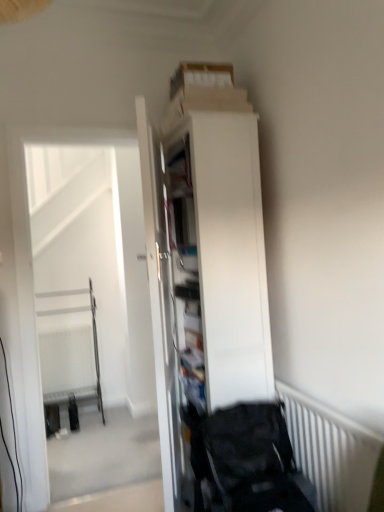
What do you see at coordinates (160, 301) in the screenshot?
I see `white glossy door at center` at bounding box center [160, 301].

Measure the distance between point (289, 449) and camera.

They are 6.43 feet apart.

The height and width of the screenshot is (512, 384). Identify the location of white striped radiator at lower right. click(331, 451).

Which object is thinner, white glossy door at center or black fabric baby carriage at lower right?

white glossy door at center is thinner.

From a real-world perspective, is white glossy door at center positioned over black fabric baby carriage at lower right based on gravity?

Yes.

How different are the orientations of white glossy door at center and black fabric baby carriage at lower right in degrees?

107 degrees separate the facing orientations of white glossy door at center and black fabric baby carriage at lower right.

Is white glossy door at center far away from white matte cabinet at center?

No, there isn't a large distance between white glossy door at center and white matte cabinet at center.

Could white matte cabinet at center be considered to be inside white glossy door at center?

No, white matte cabinet at center is located outside of white glossy door at center.

Is point (170, 390) closer or farther from the camera than point (206, 191)?

Point (170, 390) appears to be closer to the viewer than point (206, 191).

How many degrees apart are the facing directions of white glossy door at center and white matte cabinet at center?

They differ by 17.9 degrees in their facing directions.

Is white striped radiator at lower right far from black fabric baby carriage at lower right?

white striped radiator at lower right is actually quite close to black fabric baby carriage at lower right.

In the scene shown: Is white striped radiator at lower right inside or outside of black fabric baby carriage at lower right?

white striped radiator at lower right exists outside the volume of black fabric baby carriage at lower right.

The image size is (384, 512). I want to click on baby carriage located above the white striped radiator at lower right (from the image's perspective), so click(x=244, y=458).

Considering the positions of points (338, 477) and (257, 411), is point (338, 477) closer to camera compared to point (257, 411)?

Yes.

Between black fabric baby carriage at lower right and white glossy door at center, which one is positioned in front?

black fabric baby carriage at lower right.

Considering the relative sizes of black fabric baby carriage at lower right and white glossy door at center in the image provided, is black fabric baby carriage at lower right shorter than white glossy door at center?

Indeed, black fabric baby carriage at lower right has a lesser height compared to white glossy door at center.

From a real-world perspective, does black fabric baby carriage at lower right sit lower than white glossy door at center?

Yes, from a real-world perspective, black fabric baby carriage at lower right is below white glossy door at center.

From the image's perspective, which one is positioned higher, black fabric baby carriage at lower right or white striped radiator at lower right?

black fabric baby carriage at lower right.

How distant is black fabric baby carriage at lower right from white striped radiator at lower right?

black fabric baby carriage at lower right and white striped radiator at lower right are 9.90 inches apart from each other.

Is black fabric baby carriage at lower right in front of or behind white striped radiator at lower right in the image?

Visually, black fabric baby carriage at lower right is located behind white striped radiator at lower right.

Is white striped radiator at lower right a part of black fabric baby carriage at lower right?

No.

Can you tell me how much white striped radiator at lower right and white glossy door at center differ in facing direction?

18.9 degrees separate the facing orientations of white striped radiator at lower right and white glossy door at center.

From a real-world perspective, does white striped radiator at lower right sit lower than white glossy door at center?

Yes, from a real-world perspective, white striped radiator at lower right is beneath white glossy door at center.

From the picture: Who is taller, white striped radiator at lower right or white glossy door at center?

white glossy door at center is taller.

From the image's perspective, is white matte cabinet at center on top of white striped radiator at lower right?

Yes, from the image's perspective, white matte cabinet at center is above white striped radiator at lower right.

Between white matte cabinet at center and white striped radiator at lower right, which one has less height?

With less height is white striped radiator at lower right.

In the scene shown: From a real-world perspective, who is located higher, white matte cabinet at center or white striped radiator at lower right?

In real-world perspective, white matte cabinet at center is above.

Looking at this image, what's the angular difference between white matte cabinet at center and white striped radiator at lower right's facing directions?

1.04 degrees separate the facing orientations of white matte cabinet at center and white striped radiator at lower right.

The image size is (384, 512). In order to click on door behind the black fabric baby carriage at lower right in this screenshot , I will do `click(160, 301)`.

Where is `door in front of the white matte cabinet at center`? The width and height of the screenshot is (384, 512). door in front of the white matte cabinet at center is located at coordinates (160, 301).

From the image, which object appears to be farther from white striped radiator at lower right, white glossy door at center or white matte cabinet at center?

The object further to white striped radiator at lower right is white glossy door at center.

When comparing their distances from black fabric baby carriage at lower right, does white matte cabinet at center or white striped radiator at lower right seem further?

white matte cabinet at center is positioned further to the anchor black fabric baby carriage at lower right.

Estimate the real-world distances between objects in this image. Which object is further from white matte cabinet at center, white glossy door at center or white striped radiator at lower right?

Among the two, white striped radiator at lower right is located further to white matte cabinet at center.

Based on the photo, from the image, which object appears to be nearer to black fabric baby carriage at lower right, white striped radiator at lower right or white matte cabinet at center?

white striped radiator at lower right lies closer to black fabric baby carriage at lower right than the other object.

Looking at this image, looking at the image, which one is located further to white striped radiator at lower right, white matte cabinet at center or white glossy door at center?

The object further to white striped radiator at lower right is white glossy door at center.

When comparing their distances from black fabric baby carriage at lower right, does white striped radiator at lower right or white glossy door at center seem further?

white glossy door at center is further to black fabric baby carriage at lower right.

From the picture: Considering their positions, is white glossy door at center positioned further to white striped radiator at lower right than black fabric baby carriage at lower right?

white glossy door at center is further to white striped radiator at lower right.

Looking at the image, which one is located further to white striped radiator at lower right, black fabric baby carriage at lower right or white glossy door at center?

white glossy door at center is positioned further to the anchor white striped radiator at lower right.

Locate an element on the screen. This screenshot has height=512, width=384. baby carriage that lies between white matte cabinet at center and white striped radiator at lower right from top to bottom is located at coordinates (244, 458).

I want to click on dresser between white glossy door at center and white striped radiator at lower right, so click(x=204, y=271).

Locate an element on the screen. door between white matte cabinet at center and black fabric baby carriage at lower right in the up-down direction is located at coordinates (160, 301).

Locate an element on the screen. The image size is (384, 512). baby carriage between white glossy door at center and white striped radiator at lower right is located at coordinates (244, 458).